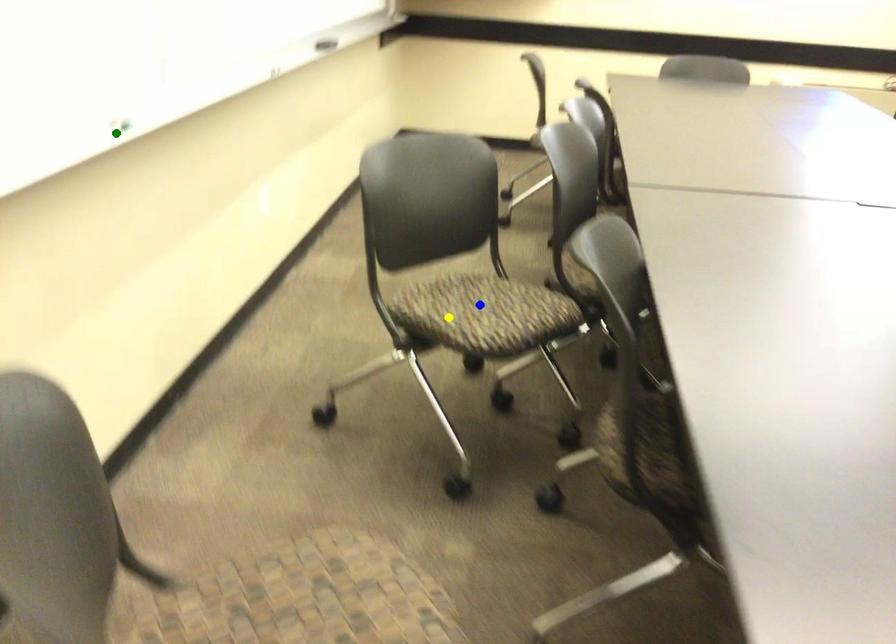
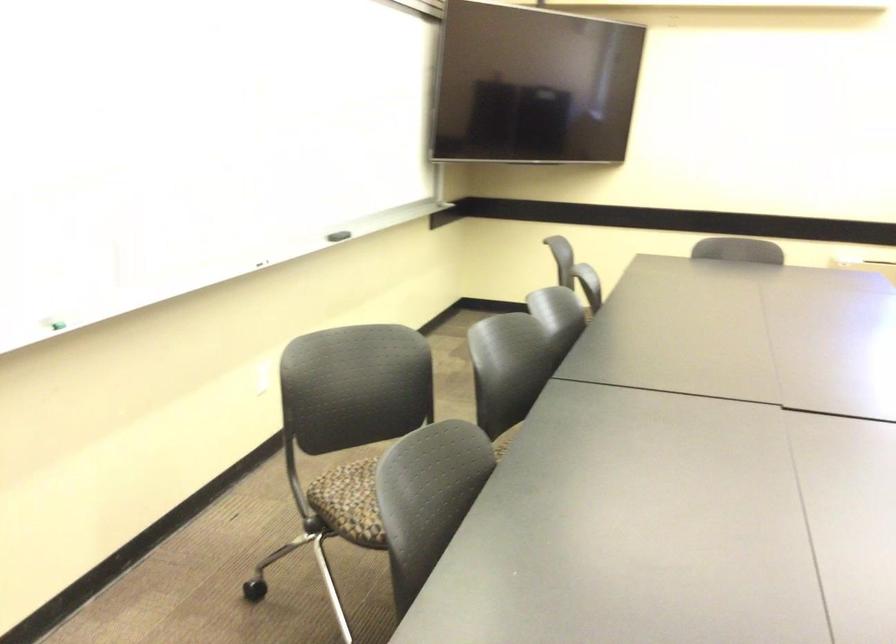
I am providing you with two images of the same scene from different viewpoints. Three points are marked in image1. Which point corresponds to a part or object that is occluded in image2?In image1, three points are marked. Which of them correspond to a part or object that is occluded in image2?Among the three points shown in image1, which one corresponds to a part or object that is no longer visible due to occlusion in image2?

Invisible in image2: blue point.